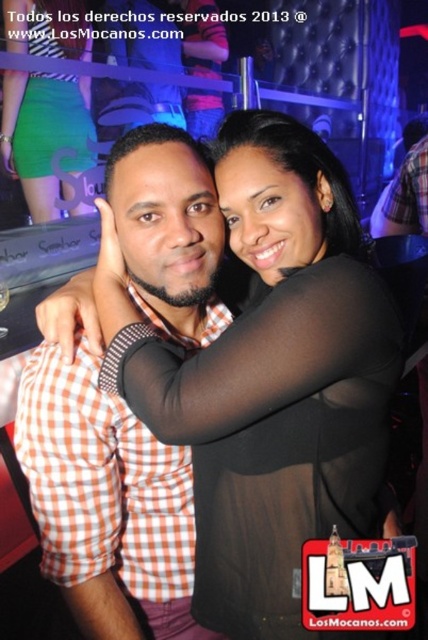
Is orange checkered shirt at center shorter than green matte skirt at lower left?

Yes, orange checkered shirt at center is shorter than green matte skirt at lower left.

Looking at this image, does orange checkered shirt at center have a smaller size compared to green matte skirt at lower left?

Indeed, orange checkered shirt at center has a smaller size compared to green matte skirt at lower left.

Does point (44, 442) come farther from viewer compared to point (35, 120)?

No, it is not.

The height and width of the screenshot is (640, 428). Find the location of `orange checkered shirt at center`. orange checkered shirt at center is located at coordinates (106, 499).

Which is behind, point (278, 157) or point (154, 316)?

The point (154, 316) is more distant.

Which is in front, point (374, 416) or point (163, 460)?

Point (374, 416) is more forward.

Where is `black sheer top at center`? The width and height of the screenshot is (428, 640). black sheer top at center is located at coordinates (270, 376).

Is black sheer top at center further to camera compared to green matte skirt at lower left?

No, it is in front of green matte skirt at lower left.

Is black sheer top at center closer to the viewer compared to green matte skirt at lower left?

Yes, it is in front of green matte skirt at lower left.

Is point (362, 522) closer to viewer compared to point (8, 1)?

That is True.

Where is `black sheer top at center`? black sheer top at center is located at coordinates (270, 376).